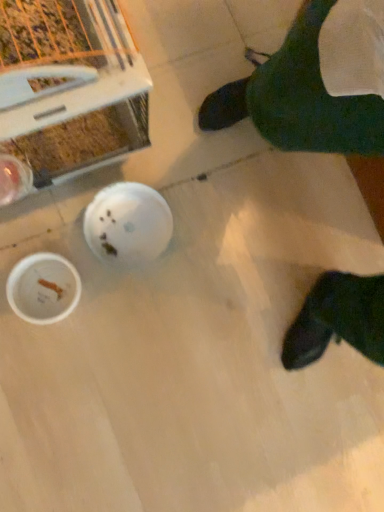
Locate an element on the screen. This screenshot has width=384, height=512. vacant space to the right of white plastic cage at upper left is located at coordinates (193, 211).